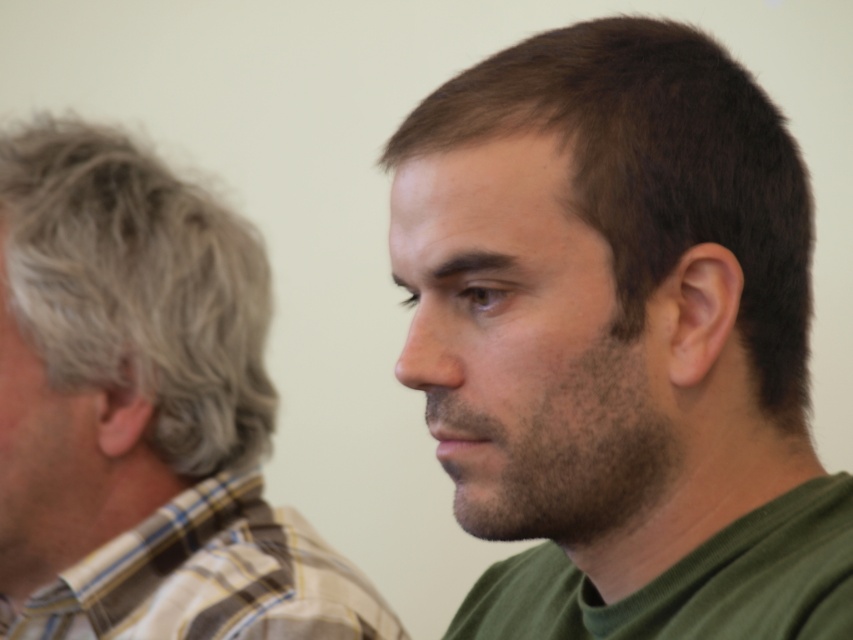
Is dark brown hair at right closer to the viewer compared to plaid shirt at left?

Yes, dark brown hair at right is in front of plaid shirt at left.

Consider the image. Who is higher up, dark brown hair at right or plaid shirt at left?

plaid shirt at left

Is point (621, 481) positioned after point (91, 548)?

No, (621, 481) is in front of (91, 548).

The height and width of the screenshot is (640, 853). Identify the location of dark brown hair at right. (619, 339).

In the scene shown: Who is lower down, dark brown hair at right or plaid fabric shirt at left?

plaid fabric shirt at left

Does point (577, 211) come in front of point (74, 608)?

Yes, it is.

The width and height of the screenshot is (853, 640). I want to click on dark brown hair at right, so click(x=619, y=339).

Identify the location of plaid shirt at left. This screenshot has width=853, height=640. (142, 412).

Between plaid shirt at left and plaid fabric shirt at left, which one appears on the right side from the viewer's perspective?

From the viewer's perspective, plaid fabric shirt at left appears more on the right side.

Locate an element on the screen. The height and width of the screenshot is (640, 853). plaid shirt at left is located at coordinates (142, 412).

Find the location of a particular element. The image size is (853, 640). plaid shirt at left is located at coordinates (142, 412).